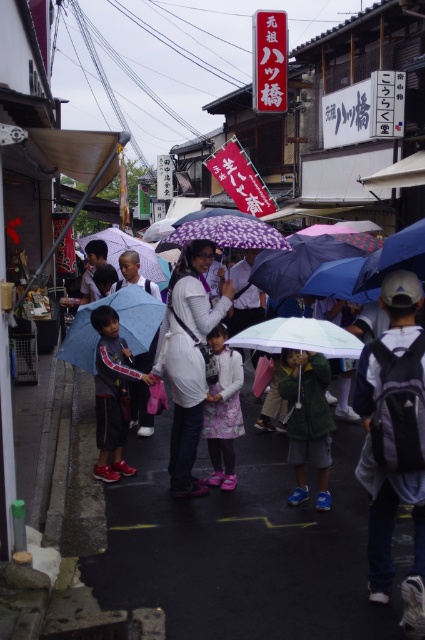
Question: Based on their relative distances, which object is farther from the translucent blue umbrella at center?

Choices:
 (A) green fuzzy coat at center
 (B) matte white jacket at center
 (C) blue matte umbrella at center

Answer: (B)

Question: Is the position of gray fabric backpack at center less distant than that of transparent plastic umbrella at center?

Choices:
 (A) no
 (B) yes

Answer: (B)

Question: Based on their relative distances, which object is farther from the matte black jacket at center?

Choices:
 (A) gray fabric backpack at center
 (B) purple matte umbrella at center

Answer: (A)

Question: Estimate the real-world distances between objects in this image. Which object is closer to the green fuzzy coat at center?

Choices:
 (A) matte black jacket at center
 (B) matte white jacket at center
 (C) floral fabric dress at center
 (D) blue matte umbrella at center

Answer: (C)

Question: From the image, what is the correct spatial relationship of gray fabric backpack at center in relation to transparent plastic umbrella at center?

Choices:
 (A) above
 (B) below

Answer: (B)

Question: Is gray fabric backpack at center thinner than purple matte umbrella at center?

Choices:
 (A) no
 (B) yes

Answer: (B)